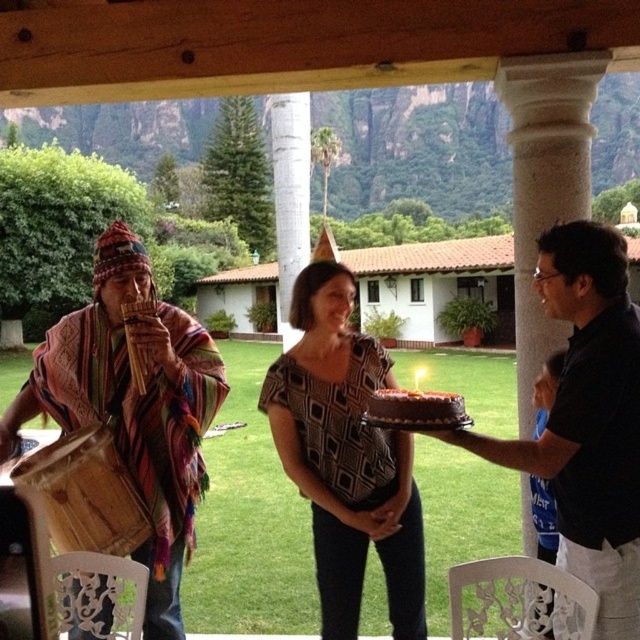
Question: Among these objects, which one is farthest from the camera?

Choices:
 (A) wooden flute at left
 (B) patterned fabric dress at center

Answer: (A)

Question: Does wooden flute at left have a greater width compared to chocolate frosted cake at center?

Choices:
 (A) no
 (B) yes

Answer: (B)

Question: Among these objects, which one is nearest to the camera?

Choices:
 (A) chocolate frosted cake at center
 (B) patterned fabric dress at center

Answer: (A)

Question: Is wooden flute at left below black matte shirt at center?

Choices:
 (A) no
 (B) yes

Answer: (B)

Question: Is patterned fabric dress at center behind wooden flute at left?

Choices:
 (A) no
 (B) yes

Answer: (A)

Question: Which point is farther to the camera?

Choices:
 (A) wooden flute at left
 (B) chocolate frosted cake at center
 (C) patterned fabric dress at center
 (D) black matte shirt at center

Answer: (A)